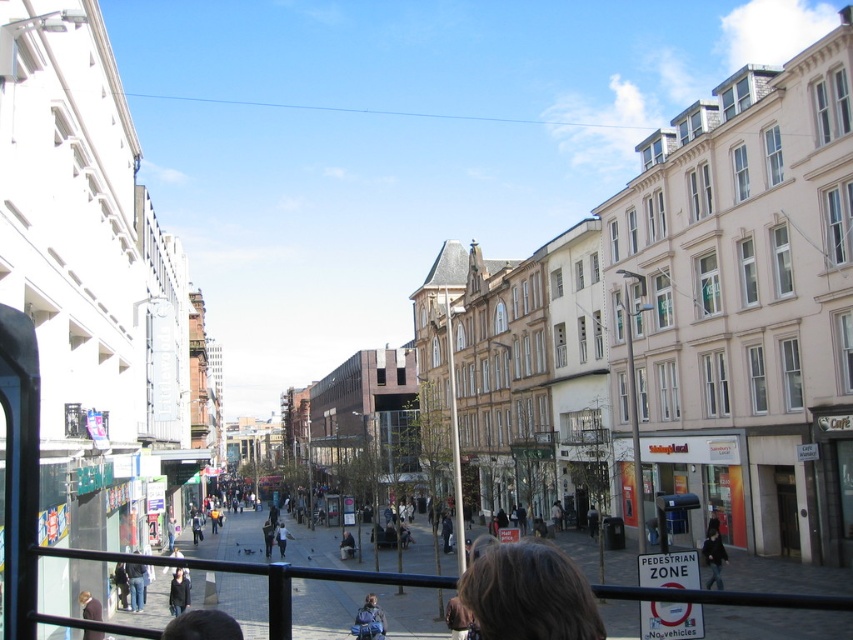
In the scene shown: Is dark blue jacket at lower right thinner than dark brown leather jacket at lower left?

Indeed, dark blue jacket at lower right has a lesser width compared to dark brown leather jacket at lower left.

In order to click on dark blue jacket at lower right in this screenshot , I will do `click(712, 557)`.

Who is more distant from viewer, (714, 584) or (84, 600)?

The point (714, 584) is more distant.

Locate an element on the screen. dark blue jacket at lower right is located at coordinates (712, 557).

Can you confirm if dark blue jacket at lower right is smaller than light brown leather bag at center?

Yes.

Consider the image. Is dark blue jacket at lower right above light brown leather bag at center?

Correct, dark blue jacket at lower right is located above light brown leather bag at center.

Identify the location of dark blue jacket at lower right. This screenshot has width=853, height=640. (712, 557).

Is dark brown hair at lower center behind dark blue jacket at lower right?

No, dark brown hair at lower center is in front of dark blue jacket at lower right.

Image resolution: width=853 pixels, height=640 pixels. I want to click on dark brown hair at lower center, so click(527, 593).

This screenshot has width=853, height=640. Identify the location of dark brown hair at lower center. (527, 593).